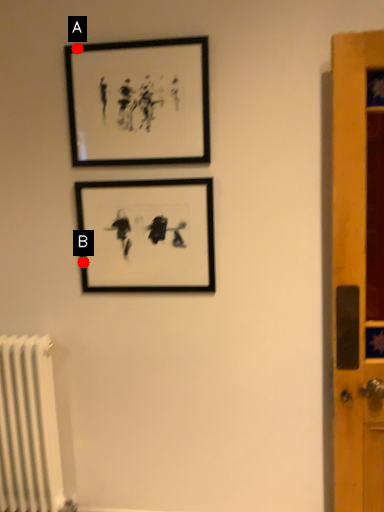
Question: Two points are circled on the image, labeled by A and B beside each circle. Which point is farther to the camera?

Choices:
 (A) A is further
 (B) B is further

Answer: (B)